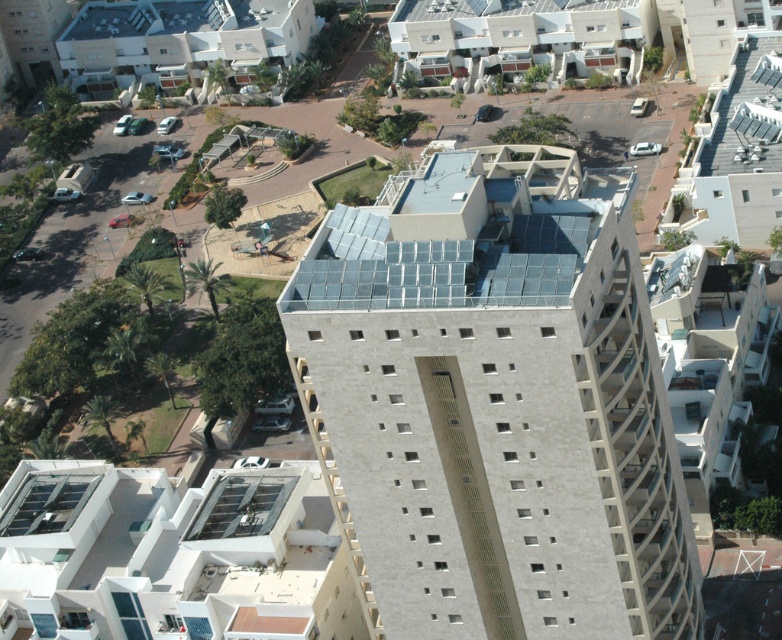
You are standing at the edge of the residential area looking towards the central building. Which building is positioned to the right when comparing the smooth concrete building at center and the beige concrete building at upper center?

The smooth concrete building at center is to the right of the beige concrete building at upper center.

You are a city planner analyzing the layout of this residential area. You need to determine if the smooth concrete building at center can accommodate a new playground in its immediate vicinity without encroaching on the white matte building at lower left. Based on their relative widths, is this feasible?

The smooth concrete building at center might be wider than white matte building at lower left, so there could be enough space between them to place the playground without encroaching. However, the exact feasibility depends on the specific width difference and available space between the two buildings.